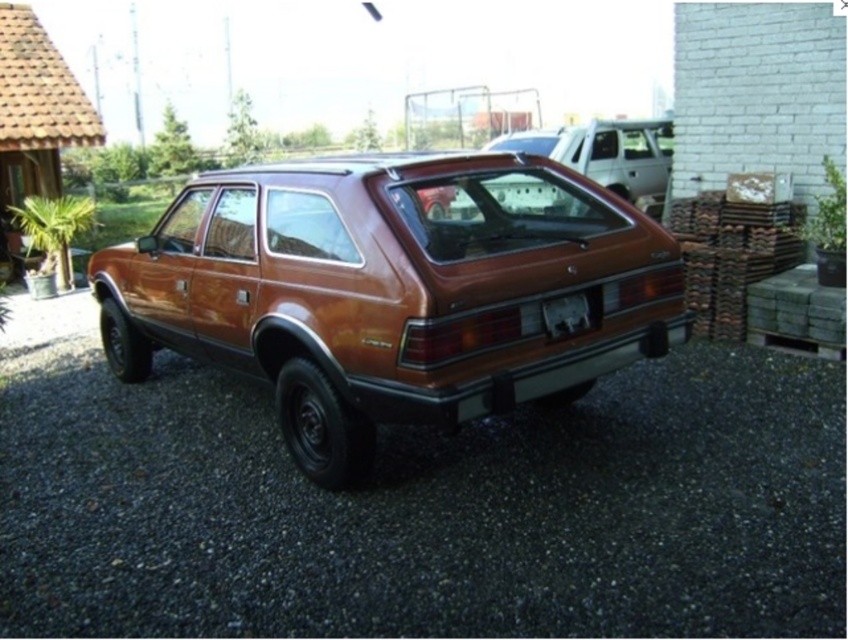
Can you confirm if satin gold car at center is taller than metallic silver suv at center?

Yes.

Which is above, satin gold car at center or metallic silver suv at center?

metallic silver suv at center is higher up.

Identify the location of satin gold car at center. This screenshot has height=640, width=848. (394, 291).

Does smooth gravel at center appear on the right side of metallic silver suv at center?

Incorrect, smooth gravel at center is not on the right side of metallic silver suv at center.

What do you see at coordinates (417, 504) in the screenshot?
I see `smooth gravel at center` at bounding box center [417, 504].

Is point (653, 451) closer to viewer compared to point (625, 157)?

Yes, point (653, 451) is in front of point (625, 157).

At what (x,y) coordinates should I click in order to perform the action: click on smooth gravel at center. Please return your answer as a coordinate pair (x, y). The image size is (848, 640). Looking at the image, I should click on (417, 504).

Is smooth gravel at center to the right of satin gold car at center from the viewer's perspective?

Indeed, smooth gravel at center is positioned on the right side of satin gold car at center.

Which is in front, point (222, 509) or point (212, 339)?

Positioned in front is point (222, 509).

Who is more forward, (393, 557) or (568, 170)?

Point (393, 557) is more forward.

I want to click on smooth gravel at center, so click(417, 504).